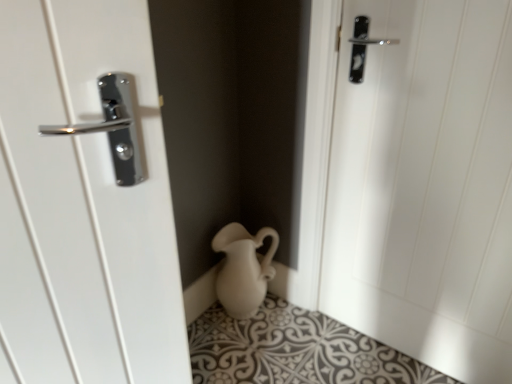
Question: Can white glossy door handle at upper center be found inside white matte jug at center?

Choices:
 (A) no
 (B) yes

Answer: (A)

Question: From the image's perspective, is white matte jug at center beneath white glossy door handle at upper center?

Choices:
 (A) no
 (B) yes

Answer: (B)

Question: Is white matte jug at center further to camera compared to white glossy door handle at upper center?

Choices:
 (A) no
 (B) yes

Answer: (B)

Question: Can you confirm if white matte jug at center is smaller than white glossy door handle at upper center?

Choices:
 (A) no
 (B) yes

Answer: (B)

Question: Does white matte jug at center have a lesser height compared to white glossy door handle at upper center?

Choices:
 (A) no
 (B) yes

Answer: (B)

Question: Is white matte jug at center bigger than white glossy door handle at upper center?

Choices:
 (A) yes
 (B) no

Answer: (B)

Question: Can we say white glossy door handle at upper center lies outside white matte jug at center?

Choices:
 (A) yes
 (B) no

Answer: (A)

Question: Is white glossy door handle at upper center aimed at white matte jug at center?

Choices:
 (A) no
 (B) yes

Answer: (A)

Question: From the image's perspective, is white glossy door handle at upper center on white matte jug at center?

Choices:
 (A) yes
 (B) no

Answer: (A)

Question: Is white matte jug at center at the back of white glossy door handle at upper center?

Choices:
 (A) no
 (B) yes

Answer: (A)

Question: Is white glossy door handle at upper center touching white matte jug at center?

Choices:
 (A) no
 (B) yes

Answer: (A)

Question: Considering the relative sizes of white glossy door handle at upper center and white matte jug at center in the image provided, is white glossy door handle at upper center smaller than white matte jug at center?

Choices:
 (A) yes
 (B) no

Answer: (B)

Question: From a real-world perspective, is white matte jug at center above or below white glossy door handle at upper center?

Choices:
 (A) below
 (B) above

Answer: (A)